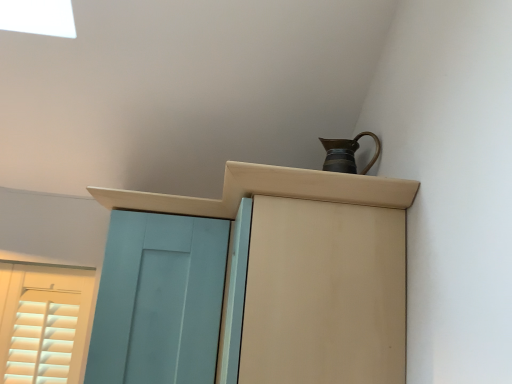
Question: From a real-world perspective, is teal matte door at left physically located above or below matte brown cupboard at upper right?

Choices:
 (A) below
 (B) above

Answer: (A)

Question: In terms of height, does teal matte door at left look taller or shorter compared to matte brown cupboard at upper right?

Choices:
 (A) short
 (B) tall

Answer: (A)

Question: Based on their relative distances, which object is farther from the matte wood cabinet at upper center?

Choices:
 (A) matte brown cupboard at upper right
 (B) teal matte door at left
 (C) metallic brown jug at upper right

Answer: (B)

Question: Which is nearer to the teal matte door at left?

Choices:
 (A) matte brown cupboard at upper right
 (B) metallic brown jug at upper right
 (C) matte wood cabinet at upper center

Answer: (A)